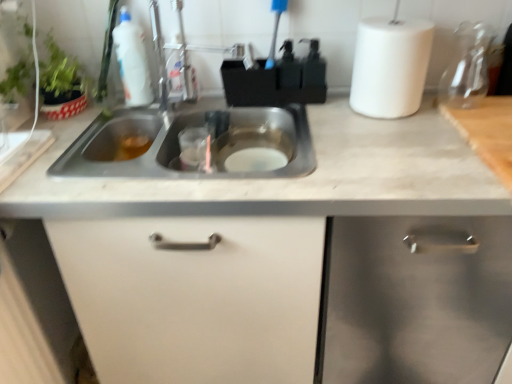
The image size is (512, 384). Find the location of `free space above white matte cabinet at right, which is the 1th cabinetry in right-to-left order (from a real-world perspective)`. free space above white matte cabinet at right, which is the 1th cabinetry in right-to-left order (from a real-world perspective) is located at coordinates (436, 139).